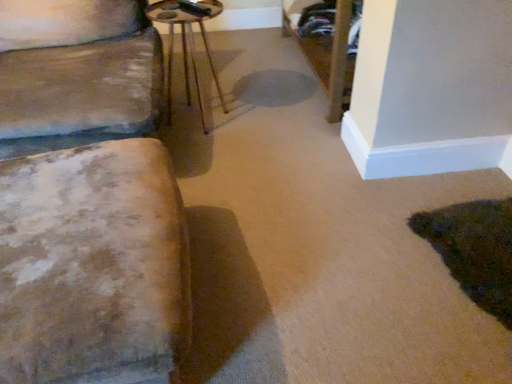
You are a GUI agent. You are given a task and a screenshot of the screen. Output one action in this format:
    pyautogui.click(x=<x>, y=<y>)
    Task: Click on the vacant space in front of metallic brown side table at center
    The height and width of the screenshot is (384, 512).
    Given the screenshot: What is the action you would take?
    pyautogui.click(x=210, y=150)